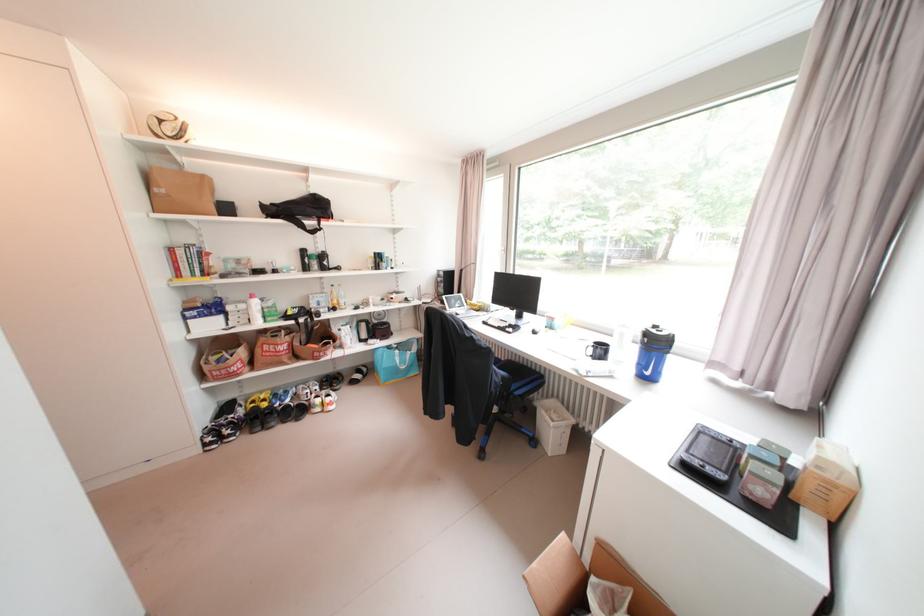
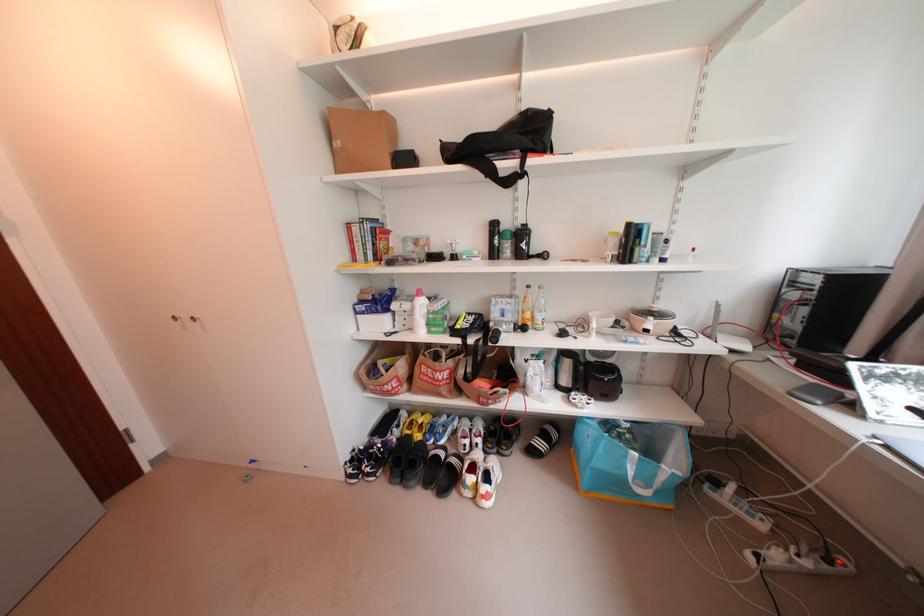
Find the pixel in the second image that matches (271,341) in the first image.

(430, 358)